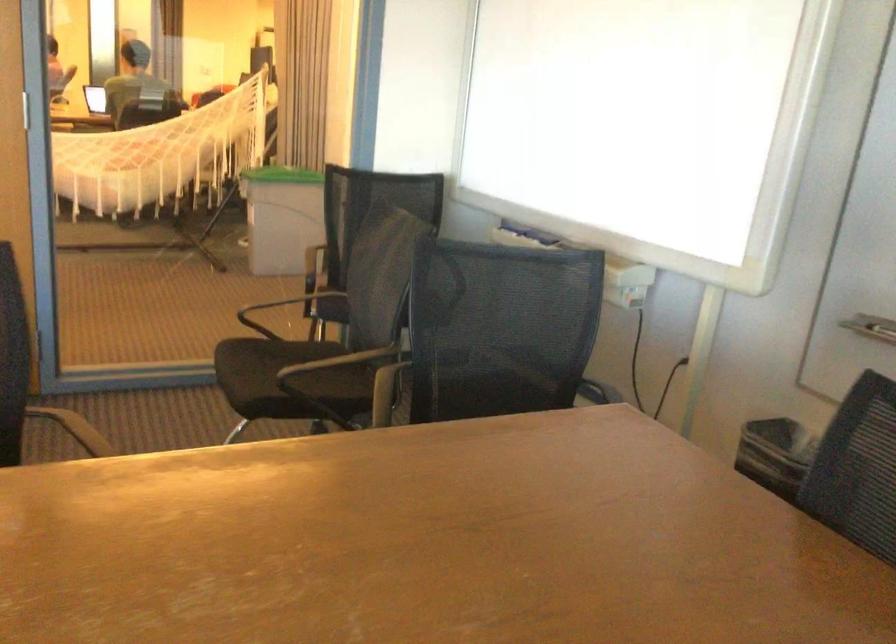
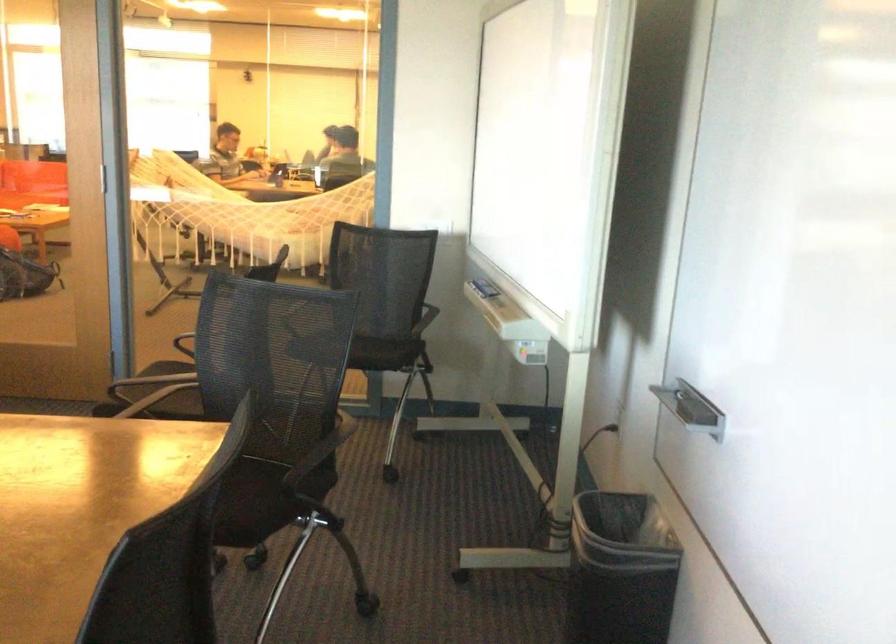
Question: I am providing you with two images of the same scene from different viewpoints. After the viewpoint changes to image2, which objects are now occluded?

Choices:
 (A) white coat rack hook
 (B) black chair armrest
 (C) chair sitting surface
 (D) black whiteboard eraser

Answer: (B)